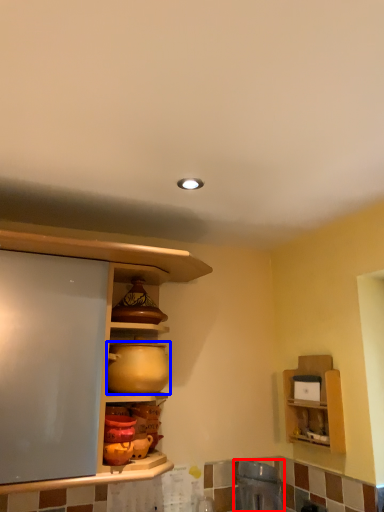
Question: Among these objects, which one is nearest to the camera, appliance (highlighted by a red box) or appliance (highlighted by a blue box)?

Choices:
 (A) appliance
 (B) appliance

Answer: (B)